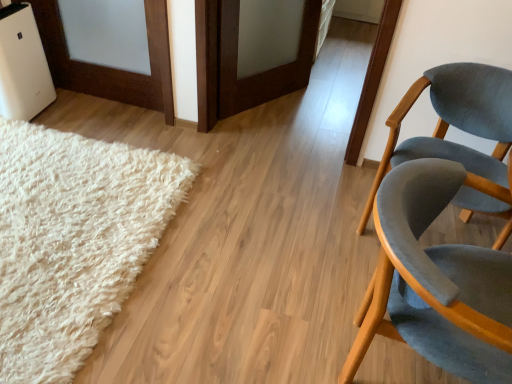
Question: In terms of size, does matte gray chair at right, placed as the 2th chair when sorted from front to back, appear bigger or smaller than velvet grey chair at right, which is the 1th chair in front-to-back order?

Choices:
 (A) big
 (B) small

Answer: (B)

Question: Considering the positions of matte gray chair at right, placed as the 2th chair when sorted from front to back, and velvet grey chair at right, which is counted as the 2th chair, starting from the back, in the image, is matte gray chair at right, placed as the 2th chair when sorted from front to back, wider or thinner than velvet grey chair at right, which is counted as the 2th chair, starting from the back,?

Choices:
 (A) thin
 (B) wide

Answer: (B)

Question: Estimate the real-world distances between objects in this image. Which object is closer to the white fluffy rug at lower left?

Choices:
 (A) matte gray chair at right, the first chair when ordered from back to front
 (B) velvet grey chair at right, which is the 1th chair in front-to-back order

Answer: (B)

Question: Based on their relative distances, which object is farther from the matte gray chair at right, the first chair when ordered from back to front?

Choices:
 (A) velvet grey chair at right, which is the 1th chair in front-to-back order
 (B) white fluffy rug at lower left

Answer: (B)